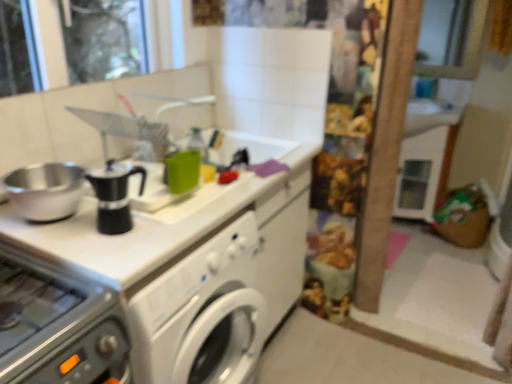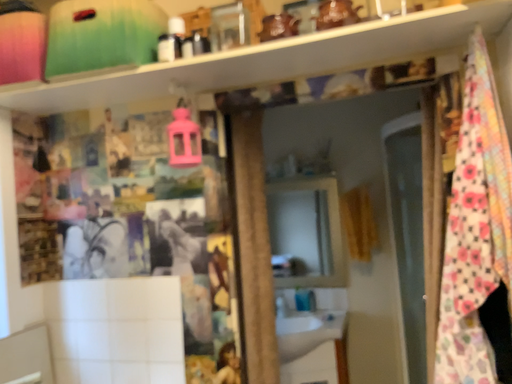
Question: How did the camera likely rotate when shooting the video?

Choices:
 (A) rotated upward
 (B) rotated downward

Answer: (A)